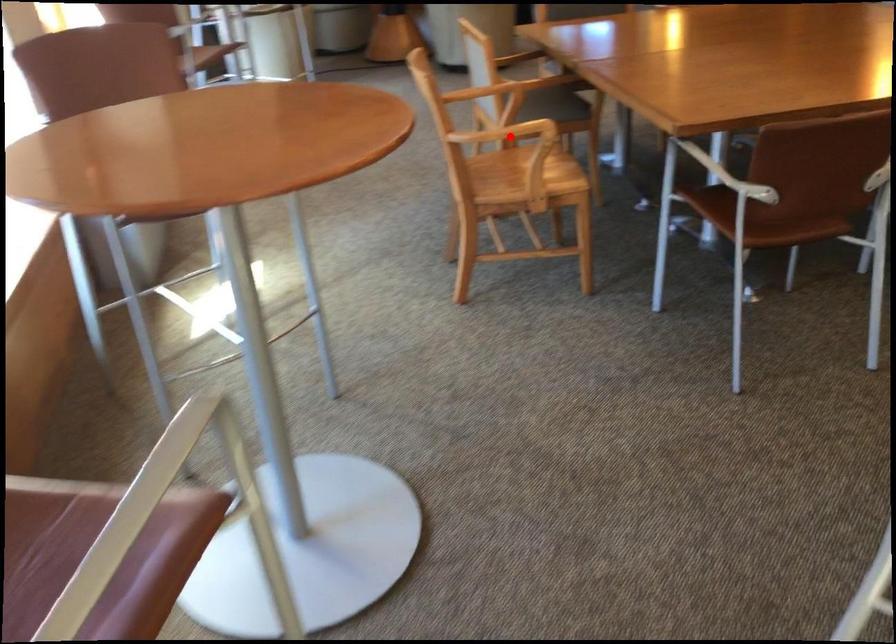
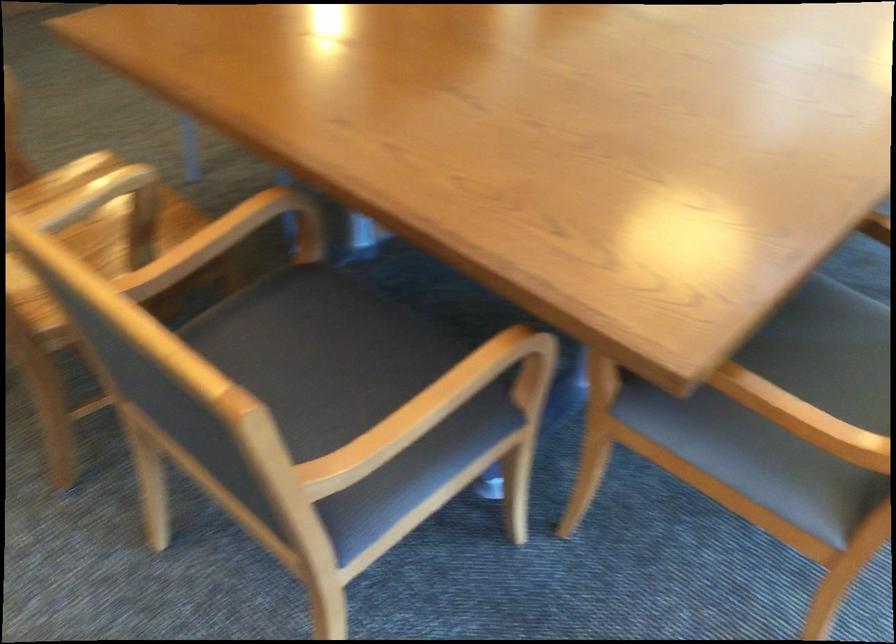
Question: I am providing you with two images of the same scene from different viewpoints. A red point is marked on the first image. Can you still see the location of the red point in image 2?

Choices:
 (A) Yes
 (B) No

Answer: (B)